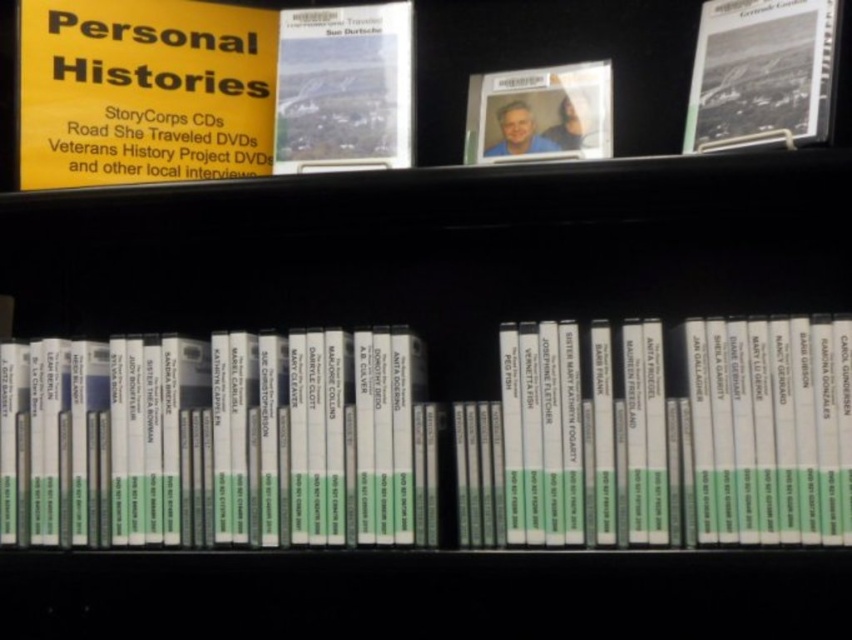
Question: Considering the relative positions of matte paper book at upper center and black textured photo album at upper right in the image provided, where is matte paper book at upper center located with respect to black textured photo album at upper right?

Choices:
 (A) above
 (B) below

Answer: (B)

Question: Can you confirm if matte paper book at upper center is thinner than matte plastic photo at center?

Choices:
 (A) no
 (B) yes

Answer: (B)

Question: Among these objects, which one is farthest from the camera?

Choices:
 (A) matte plastic photo at center
 (B) matte paper book at upper center
 (C) white glossy cd cases at center
 (D) black textured photo album at upper right

Answer: (A)

Question: Among these points, which one is nearest to the camera?

Choices:
 (A) (306, 92)
 (B) (550, 529)
 (C) (531, 147)

Answer: (B)

Question: Is matte paper book at upper center closer to the viewer compared to matte plastic photo at center?

Choices:
 (A) no
 (B) yes

Answer: (B)

Question: Among these objects, which one is nearest to the camera?

Choices:
 (A) yellow paper sign at upper left
 (B) matte plastic photo at center
 (C) black textured photo album at upper right
 (D) white glossy cd cases at center

Answer: (D)